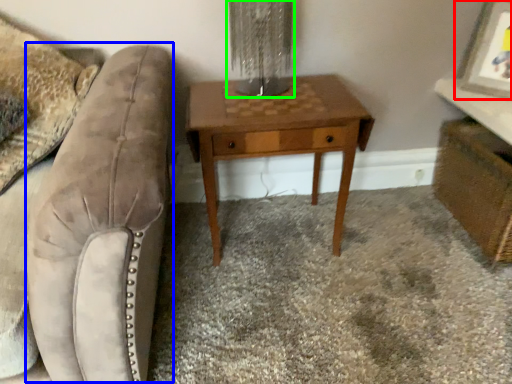
Question: Considering the real-world distances, which object is closest to picture frame (highlighted by a red box)? swivel chair (highlighted by a blue box) or table lamp (highlighted by a green box).

Choices:
 (A) swivel chair
 (B) table lamp

Answer: (B)